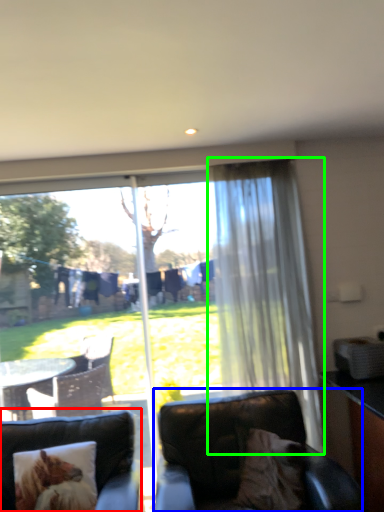
Question: Which object is the farthest from studio couch (highlighted by a red box)? Choose among these: chair (highlighted by a blue box) or curtain (highlighted by a green box).

Choices:
 (A) chair
 (B) curtain

Answer: (B)